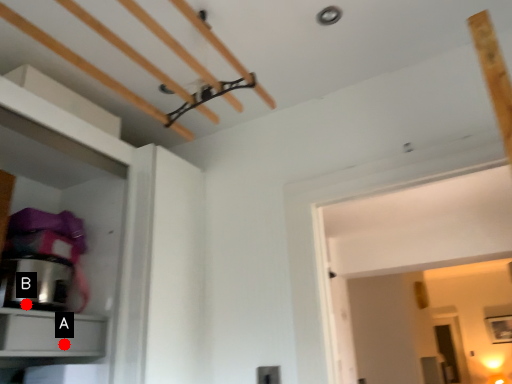
Question: Two points are circled on the image, labeled by A and B beside each circle. Which point is further to the camera?

Choices:
 (A) A is further
 (B) B is further

Answer: (B)